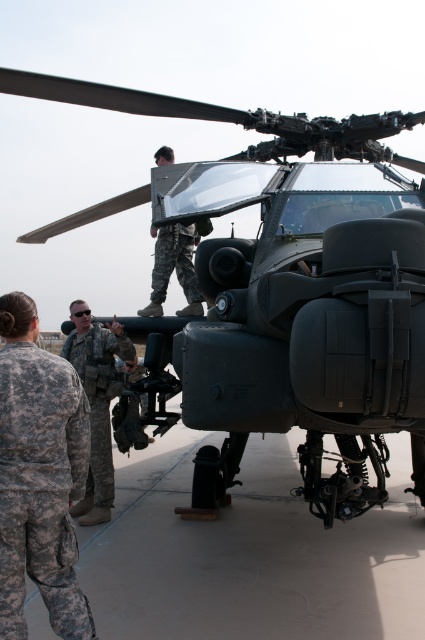
Question: Which point appears closest to the camera in this image?

Choices:
 (A) (193, 308)
 (B) (107, 400)

Answer: (B)

Question: Which of the following is the farthest from the observer?

Choices:
 (A) camouflage fabric uniform at lower left
 (B) camouflage uniform at lower left

Answer: (B)

Question: In this image, where is camouflage uniform at lower left located relative to camouflage fabric uniform at center?

Choices:
 (A) below
 (B) above

Answer: (A)

Question: Is matte black helicopter at center to the left of camouflage uniform at lower left from the viewer's perspective?

Choices:
 (A) no
 (B) yes

Answer: (A)

Question: Is camouflage fabric uniform at lower left wider than camouflage fabric uniform at center?

Choices:
 (A) no
 (B) yes

Answer: (A)

Question: Which point is closer to the camera?

Choices:
 (A) (x=17, y=579)
 (B) (x=99, y=384)
 (C) (x=263, y=374)

Answer: (A)